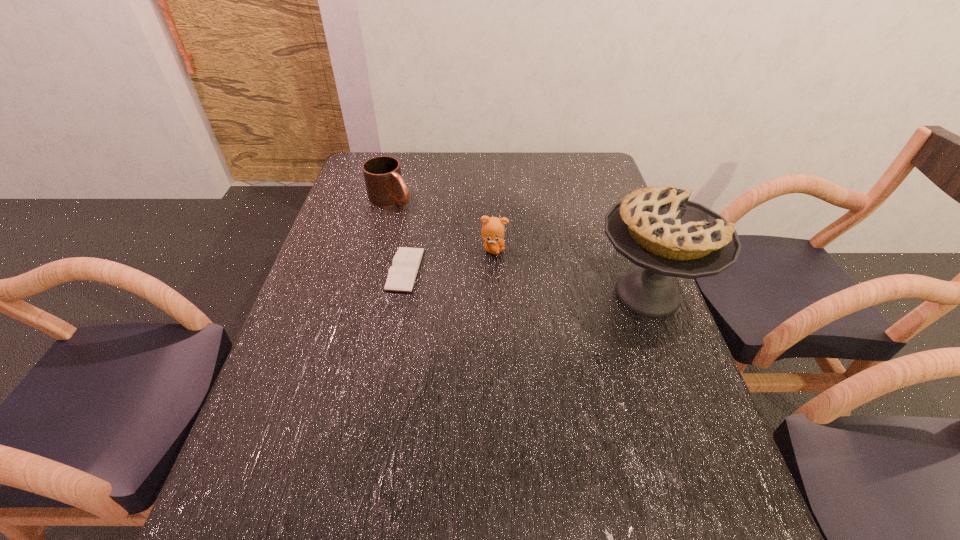
Locate an element on the screen. vacant space located 0.280m on the face of the teddy bear is located at coordinates click(x=586, y=305).

Find the location of a particular element. This screenshot has width=960, height=540. free location located on the face of the teddy bear is located at coordinates click(602, 315).

Find the location of a particular element. Image resolution: width=960 pixels, height=540 pixels. object present at the left edge is located at coordinates (385, 186).

Identify the location of object situated at the right edge. Image resolution: width=960 pixels, height=540 pixels. (657, 228).

In the image, there is a desktop. Where is `free region at the far edge`? free region at the far edge is located at coordinates (428, 182).

Where is `vacant space at the near edge of the desktop`? This screenshot has width=960, height=540. vacant space at the near edge of the desktop is located at coordinates (351, 488).

Locate an element on the screen. The width and height of the screenshot is (960, 540). vacant space at the left edge of the desktop is located at coordinates (357, 285).

You are a GUI agent. You are given a task and a screenshot of the screen. Output one action in this format:
    pyautogui.click(x=<x>, y=<y>)
    Task: Click on the free space at the right edge of the desktop
    Image resolution: width=960 pixels, height=540 pixels.
    Given the screenshot: What is the action you would take?
    pyautogui.click(x=616, y=359)

Where is `vacant space at the far right corner of the desktop`? The image size is (960, 540). vacant space at the far right corner of the desktop is located at coordinates 567,181.

Locate an element on the screen. free space between the farthest object and the rightmost object is located at coordinates (519, 246).